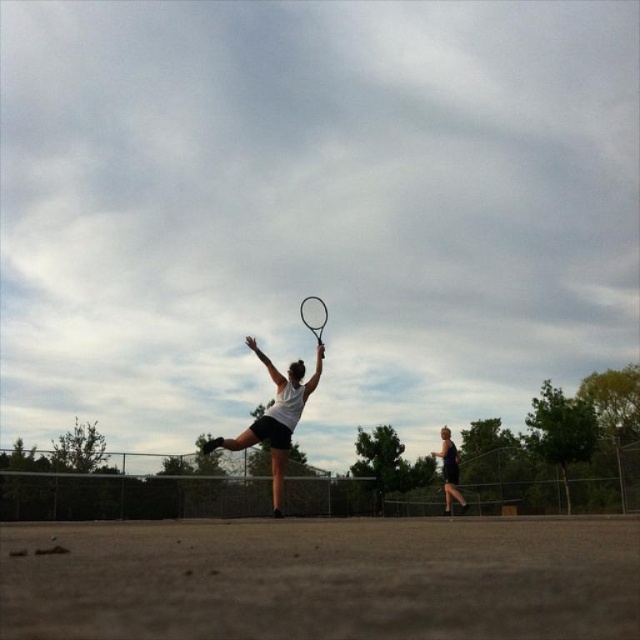
Question: Which point is closer to the camera taking this photo?

Choices:
 (A) (253, 435)
 (B) (442, 435)

Answer: (A)

Question: Which point is farther to the camera?

Choices:
 (A) purple fabric shorts at right
 (B) white matte tennis racket at center
 (C) black matte tennis racket at center

Answer: (A)

Question: Where is purple fabric shorts at right located in relation to black matte tennis racket at center in the image?

Choices:
 (A) below
 (B) above

Answer: (A)

Question: Which of the following is the closest to the observer?

Choices:
 (A) (445, 426)
 (B) (326, 310)

Answer: (B)

Question: Is white matte tennis racket at center positioned before purple fabric shorts at right?

Choices:
 (A) yes
 (B) no

Answer: (A)

Question: Is purple fabric shorts at right thinner than black matte tennis racket at center?

Choices:
 (A) yes
 (B) no

Answer: (B)